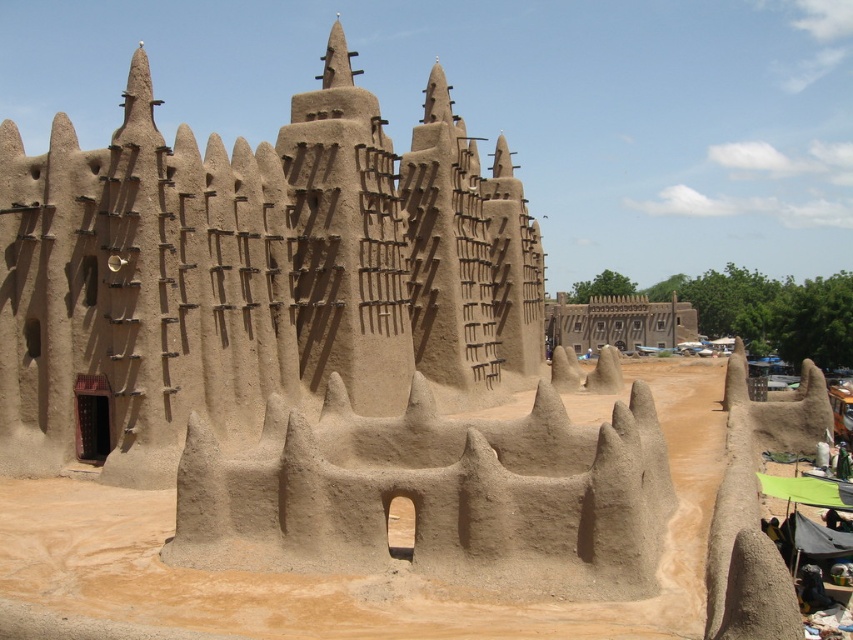
You are standing in front of the traditional mud structure and want to touch the sandy beige mud at center and the brown mud wall at center. Which one can you reach without moving your position?

The sandy beige mud at center is closer to you, so you can reach it without moving, but the brown mud wall at center is further away and requires moving closer.

You are an archaeologist examining the traditional mud structure. You notice the sandy beige mud at center and the brown mud wall at center. Which of these two elements is located higher up in the structure?

The sandy beige mud at center is positioned over the brown mud wall at center, so it is located higher up in the structure.